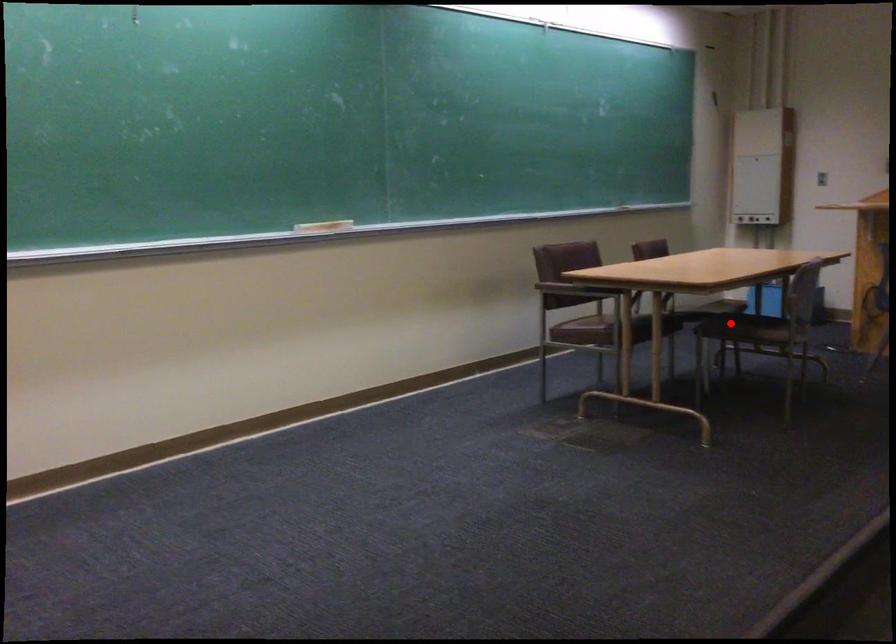
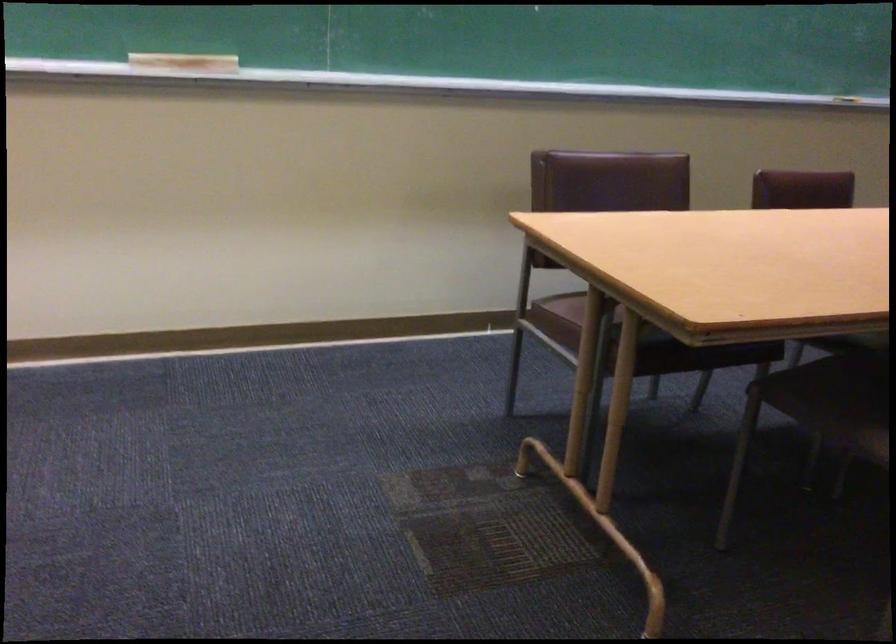
Question: I am providing you with two images of the same scene from different viewpoints. Image1 has a red point marked. In image2, the corresponding 3D location appears at what relative position? Reply with the corresponding letter.

Choices:
 (A) Closer
 (B) Farther

Answer: (A)